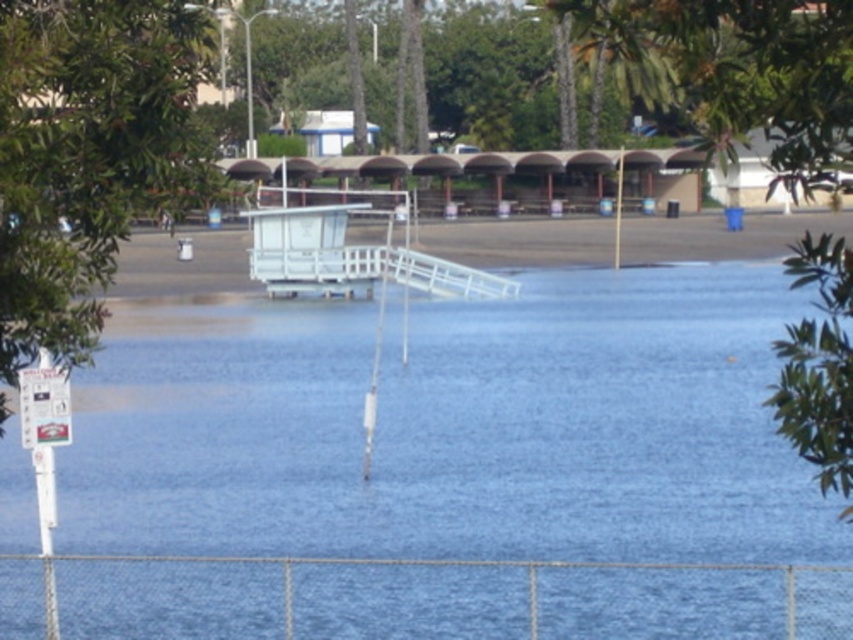
Measure the distance from green leafy tree at left to white plastic dock at center.

green leafy tree at left and white plastic dock at center are 70.19 meters apart from each other.

Looking at this image, who is more distant from viewer, (20, 129) or (303, 179)?

Positioned behind is point (303, 179).

I want to click on green leafy tree at left, so click(86, 154).

Does blue water at center have a larger size compared to green leafy tree at left?

Yes, blue water at center is bigger than green leafy tree at left.

Consider the image. Which of these two, blue water at center or green leafy tree at left, stands shorter?

With less height is green leafy tree at left.

Describe the element at coordinates (453, 428) in the screenshot. Image resolution: width=853 pixels, height=640 pixels. I see `blue water at center` at that location.

Locate an element on the screen. blue water at center is located at coordinates coord(453,428).

Does blue water at center have a lesser width compared to white plastic dock at center?

Correct, blue water at center's width is less than white plastic dock at center's.

Can you confirm if blue water at center is bigger than white plastic dock at center?

Actually, blue water at center might be smaller than white plastic dock at center.

Is point (329, 548) positioned before point (242, 163)?

Yes, it is in front of point (242, 163).

In order to click on blue water at center in this screenshot , I will do `click(453, 428)`.